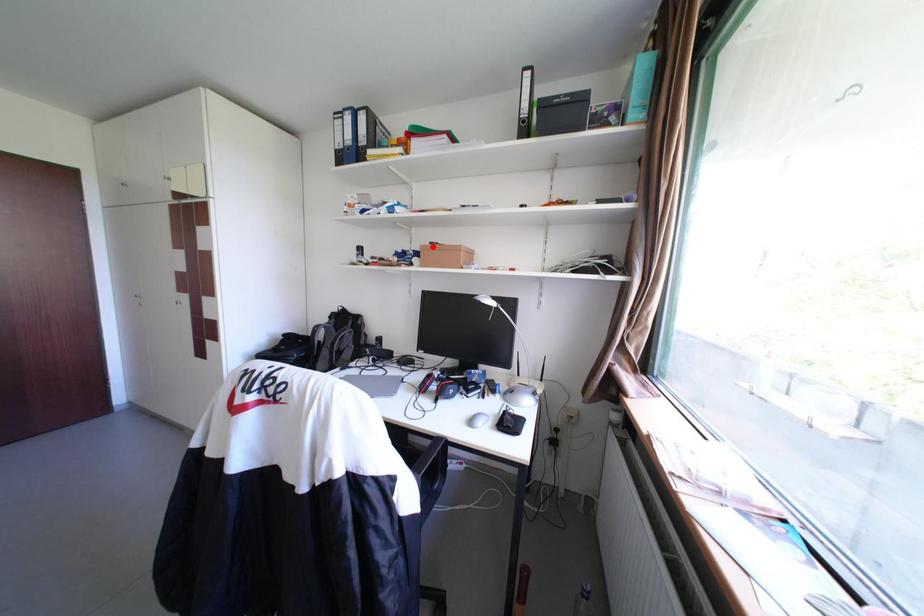
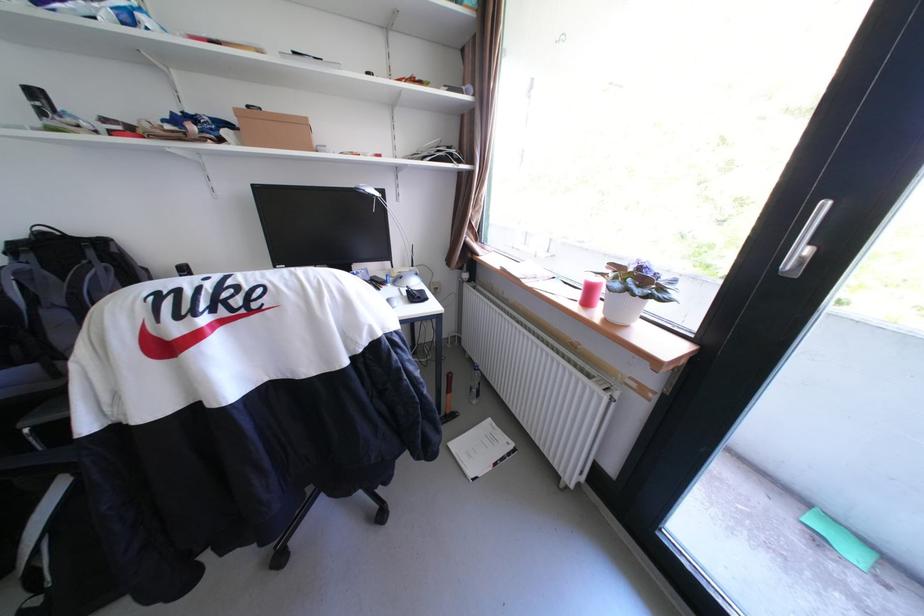
Find the pixel in the second image that matches the highlighted location in the first image.

(247, 111)